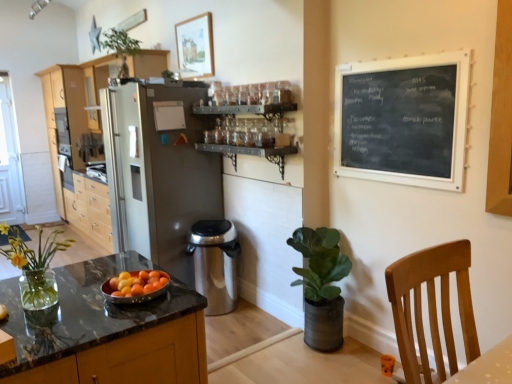
The width and height of the screenshot is (512, 384). I want to click on vacant area in front of silver metallic trash can at center, so [236, 324].